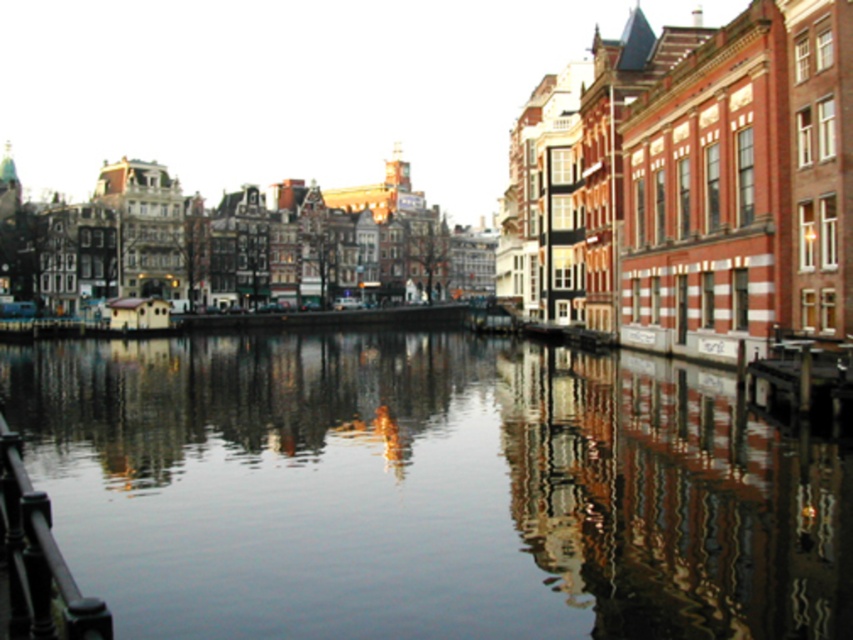
You are a tourist standing at the edge of the canal. You want to take a photo that includes both the smooth reflective water at center and the black metal railing at lower left. Which object should you position closer to the center of your camera frame to ensure both are fully visible?

You should position the smooth reflective water at center closer to the center of your camera frame because its width is greater than the black metal railing at lower left, making it a larger subject to capture fully.

You are standing on a bridge overlooking the canal. You notice the smooth reflective water at center and the black metal railing at lower left. Which object is located below the other?

The smooth reflective water at center is positioned over the black metal railing at lower left, meaning the black metal railing at lower left is below the smooth reflective water at center.

You are standing at the edge of the canal and want to lean on the black metal railing at lower left to take a photo of the smooth reflective water at center. Is the railing accessible from your current position?

The black metal railing at lower left is behind the smooth reflective water at center, so you would need to move around the water to reach it from your current position.